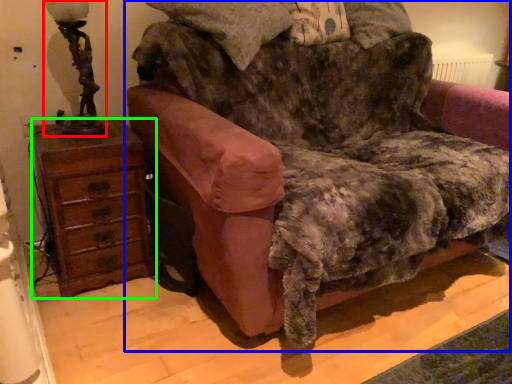
Question: Which object is the farthest from table lamp (highlighted by a red box)? Choose among these: furniture (highlighted by a blue box) or chest of drawers (highlighted by a green box).

Choices:
 (A) furniture
 (B) chest of drawers

Answer: (A)